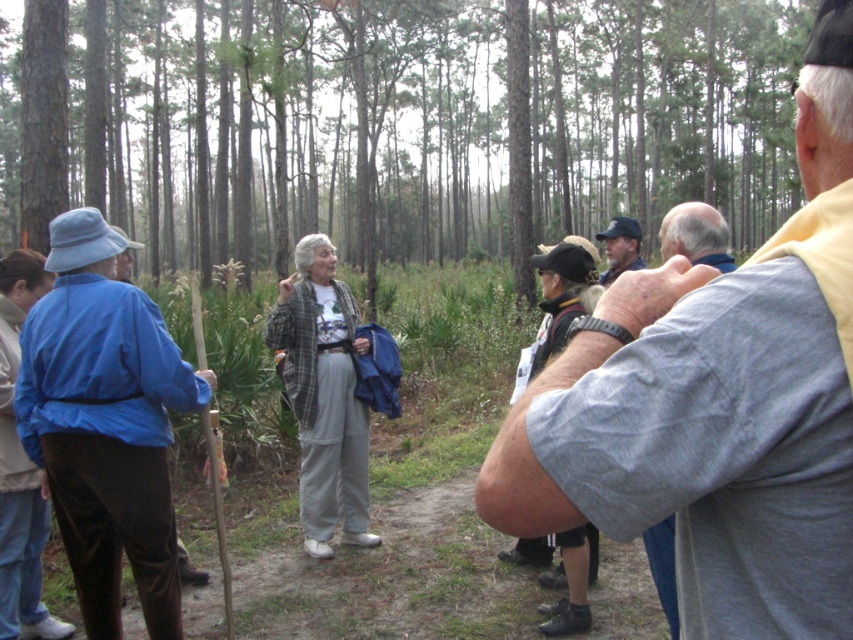
You are standing at the camera position and want to reach the point marked at coordinates (x=680, y=416) in the forest scene. If your average walking pace is 3 feet per second, how many seconds will it take you to reach that point?

The distance between the camera and the point marked at coordinates (x=680, y=416) is 33.39 inches. Converting this distance to feet, it is approximately 2.78 feet. At a walking pace of 3 feet per second, it would take roughly 0.93 seconds to reach the point.

You are a photographer trying to capture a photo of the plaid fabric jacket at center without the gray fabric shirt at upper right blocking it. What should you do?

Move your position so that the plaid fabric jacket at center is no longer behind the gray fabric shirt at upper right.

You are standing at the point with coordinates point (70, 340) and want to walk towards the point with coordinates point (747, 570). Since you are in a forest, you need to know if you will be moving towards or away from the camera. Based on the description, which direction are you moving relative to the camera?

You are moving away from the camera because point (747, 570) is closer to the camera than point (70, 340), so walking towards it means moving away from the camera.